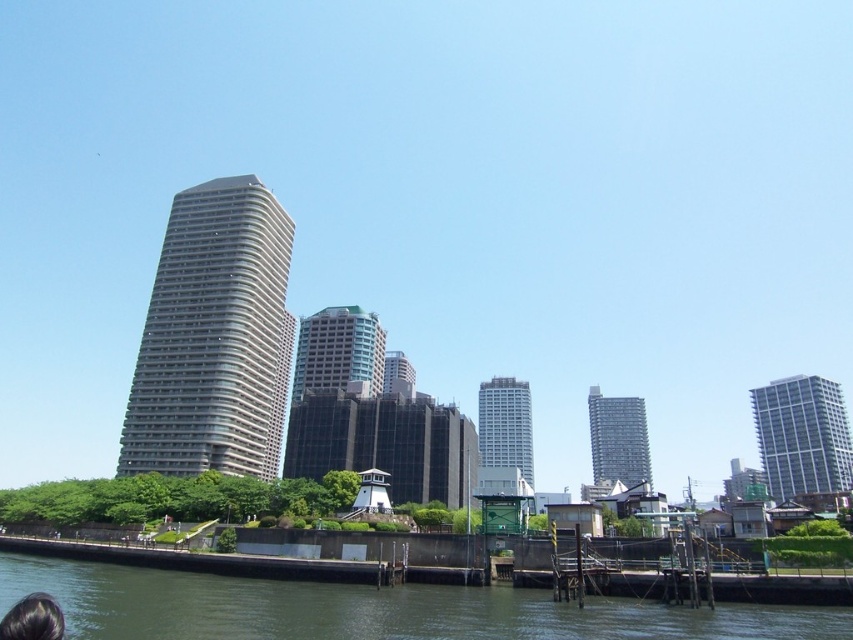
Looking at this image, you are standing on the dock and want to locate the white glossy building at right. According to the coordinates provided, where should you look relative to your position?

The white glossy building at right is located at coordinates point (802,436), which means it is positioned to the right and slightly below your current line of sight.

Looking at this image, you are standing at the point with coordinates point (263, 301) and want to move towards point (515, 420). Based on the cityscape scene described, will you be moving towards or away from the tall rectangular skyscraper with the glass facade?

Since point (263, 301) is in front of point (515, 420), moving from point (263, 301) towards point (515, 420) would mean moving away from the tall rectangular skyscraper with the glass facade, as you are moving towards a point that is further back in the scene.

You are standing on a pier looking at the green concrete river at lower center and the gray glassy building at center. Which object is nearer to you?

The green concrete river at lower center is closer to the viewer than the gray glassy building at center.